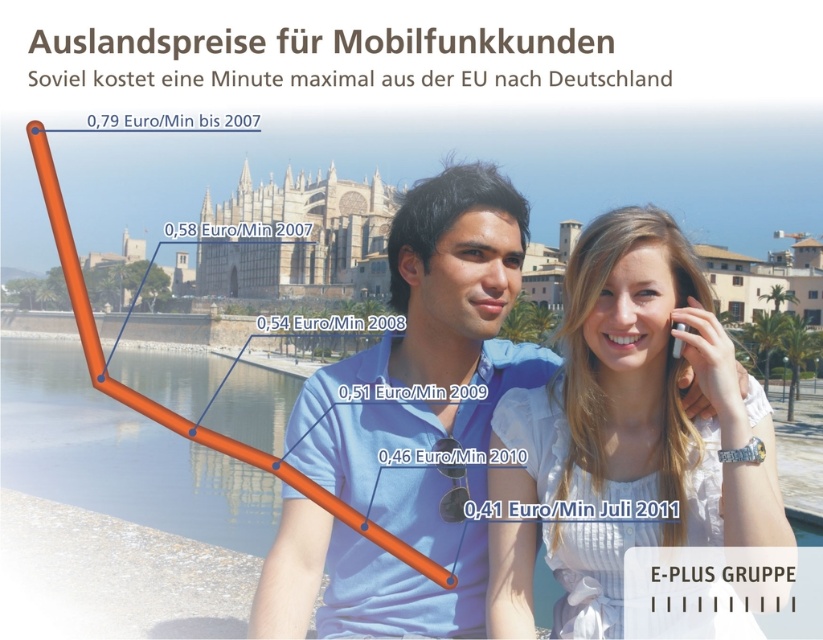
You are a GUI agent. You are given a task and a screenshot of the screen. Output one action in this format:
    pyautogui.click(x=<x>, y=<y>)
    Task: Click on the light blue shirt at center
    
    Given the screenshot: What is the action you would take?
    pyautogui.click(x=458, y=292)

Can you confirm if light blue shirt at center is bigger than white plastic phone at upper right?

Indeed, light blue shirt at center has a larger size compared to white plastic phone at upper right.

This screenshot has width=823, height=640. Identify the location of light blue shirt at center. (458, 292).

Does point (521, 557) come farther from viewer compared to point (695, 330)?

No, it is not.

Is point (598, 291) positioned in front of point (693, 330)?

No, (598, 291) is further to viewer.

This screenshot has width=823, height=640. Identify the location of white glossy phone at upper right. (626, 433).

Can you confirm if white glossy phone at upper right is positioned to the right of light blue shirt at center?

Correct, you'll find white glossy phone at upper right to the right of light blue shirt at center.

Does white glossy phone at upper right come in front of light blue shirt at center?

Yes.

Is point (626, 538) closer to viewer compared to point (472, 305)?

Yes, it is in front of point (472, 305).

You are a GUI agent. You are given a task and a screenshot of the screen. Output one action in this format:
    pyautogui.click(x=<x>, y=<y>)
    Task: Click on the white glossy phone at upper right
    The width and height of the screenshot is (823, 640).
    Given the screenshot: What is the action you would take?
    pyautogui.click(x=626, y=433)